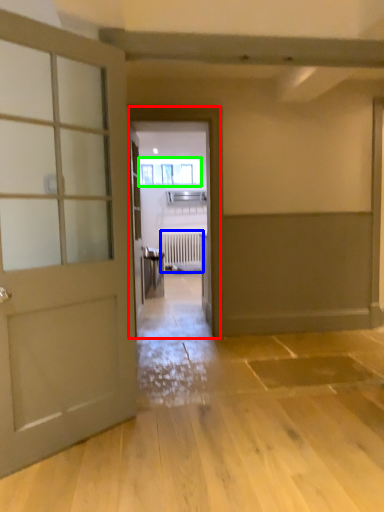
Question: Considering the real-world distances, which object is farthest from elevator (highlighted by a red box)? radiator (highlighted by a blue box) or window (highlighted by a green box)?

Choices:
 (A) radiator
 (B) window

Answer: (B)